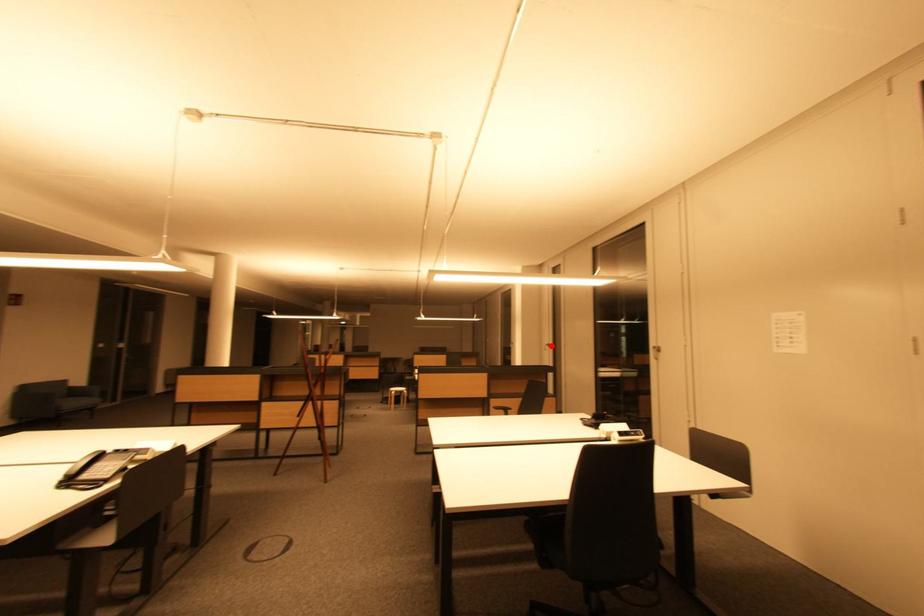
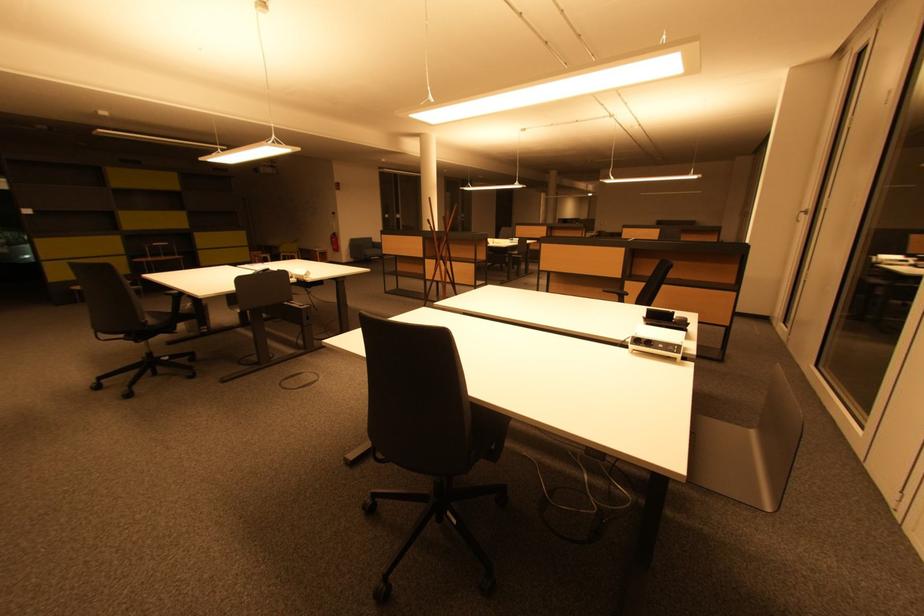
Where in the second image is the point corresponding to the highlighted location from the first image?

(808, 212)